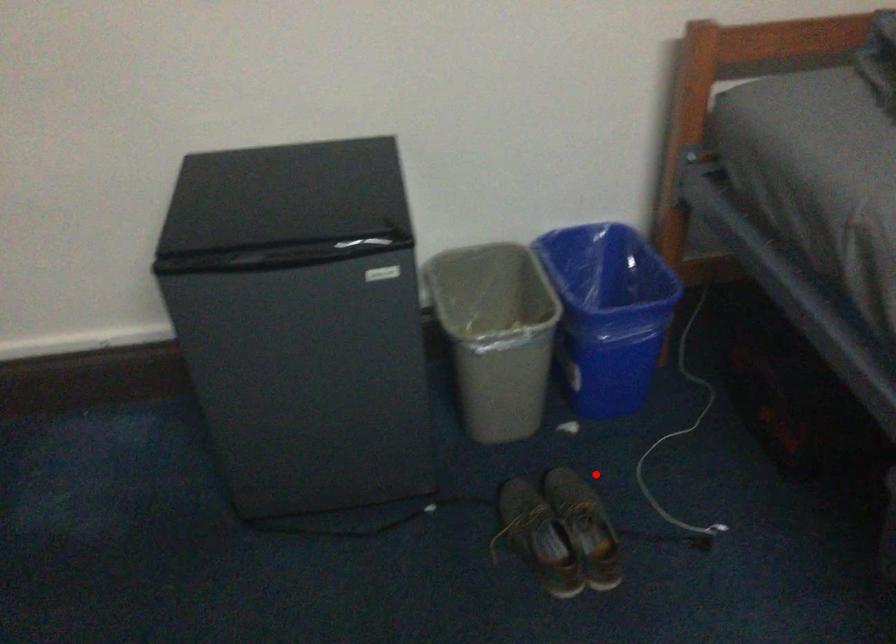
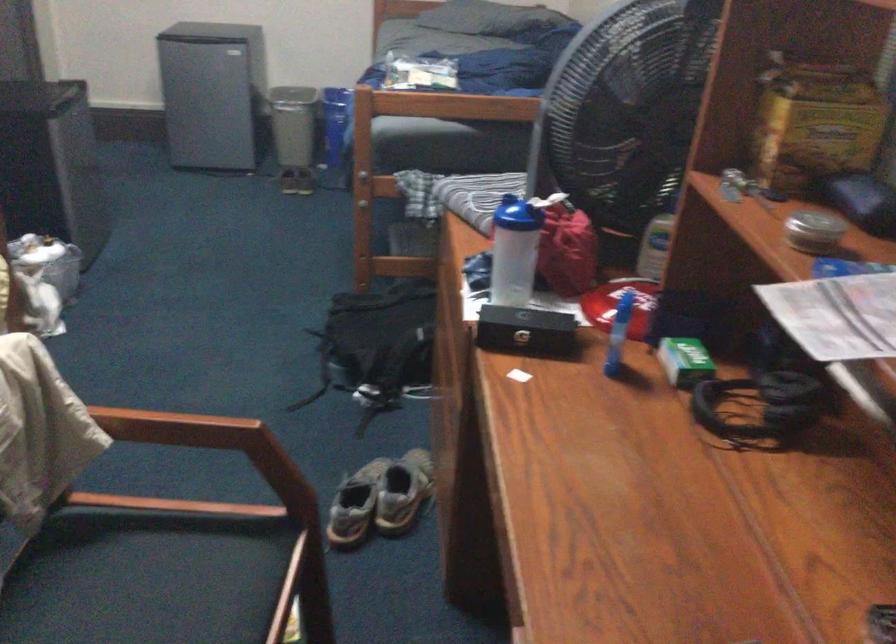
Question: I am providing you with two images of the same scene from different viewpoints. Given a red point in image1, look at the same physical point in image2. Is it:

Choices:
 (A) Closer to the viewpoint
 (B) Farther from the viewpoint

Answer: (B)